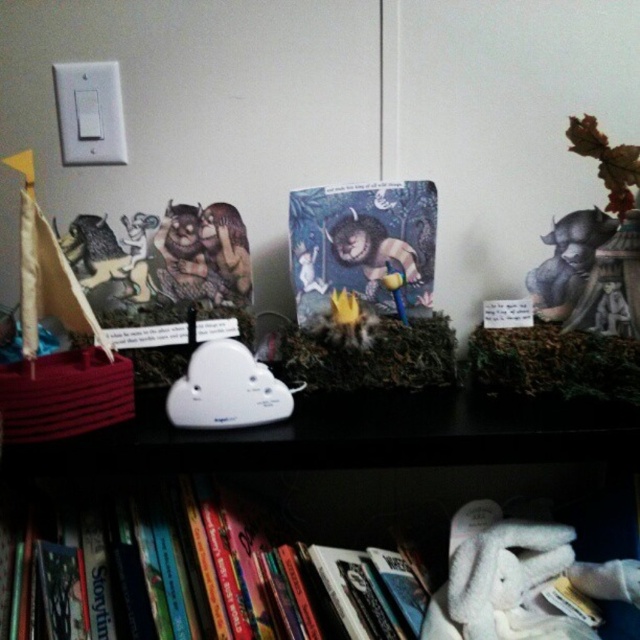
Looking at this image, which is below, hardcover book at lower left or hardcover books at center?

hardcover book at lower left

Between point (145, 524) and point (628, 452), which one is positioned in front?

Point (628, 452) is in front.

This screenshot has height=640, width=640. I want to click on hardcover book at lower left, so click(244, 576).

Is the position of hardcover book at lower left more distant than that of white plastic cloud at center?

No, it is not.

Who is positioned more to the left, hardcover book at lower left or white plastic cloud at center?

hardcover book at lower left is more to the left.

Locate an element on the screen. The width and height of the screenshot is (640, 640). hardcover book at lower left is located at coordinates (244, 576).

Is hardcover books at center taller than white plastic cloud at center?

In fact, hardcover books at center may be shorter than white plastic cloud at center.

Locate an element on the screen. hardcover books at center is located at coordinates (355, 436).